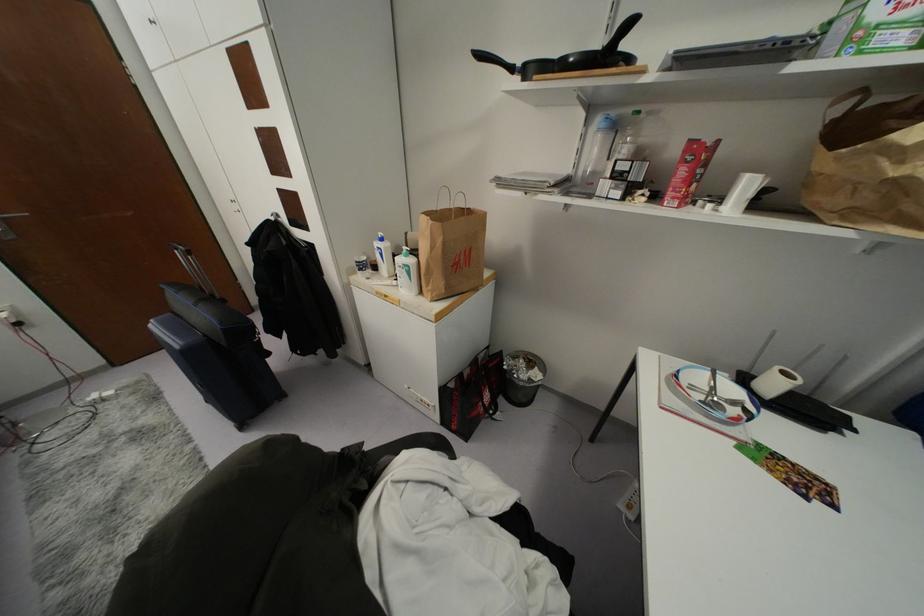
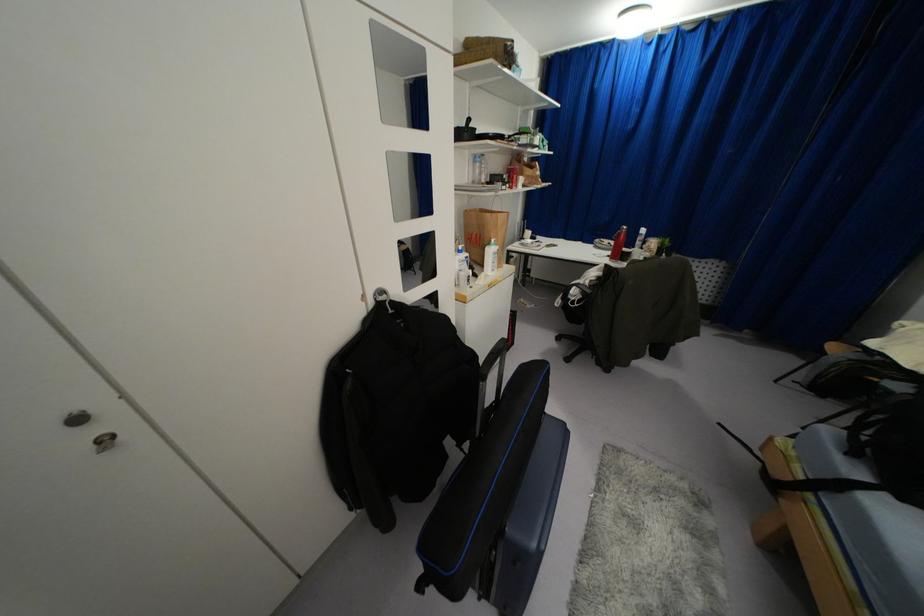
Find the pixel in the second image that matches point 410,261 in the first image.

(495, 246)